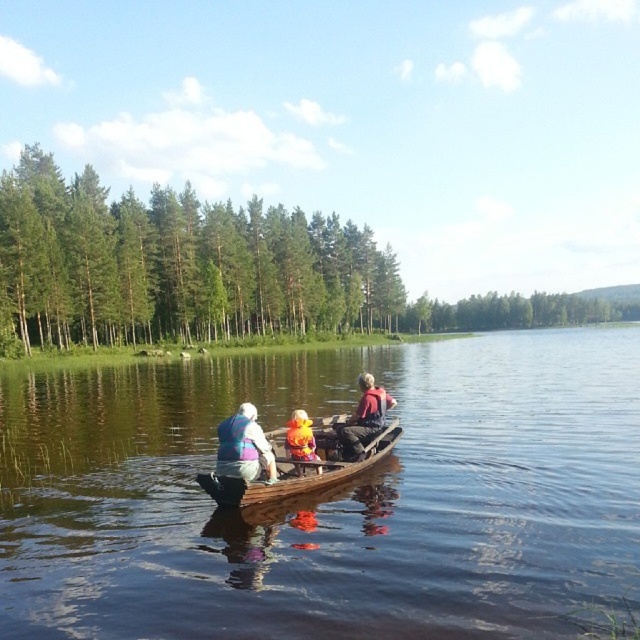
You are in a wooden boat on a calm lake with two points marked on the water surface. The first point is at coordinates point (x=547, y=403) and the second is at point (x=310, y=456). From your position in the boat, which point is closer to you?

Point (x=310, y=456) is closer to you because point (x=547, y=403) is behind it.

You are standing on the dock and see the brown wooden boat at center and the wooden paddle at center in the water. Which object is closer to you?

The brown wooden boat at center is closer to you because it is positioned above the wooden paddle at center, indicating it is higher in the water and thus nearer.